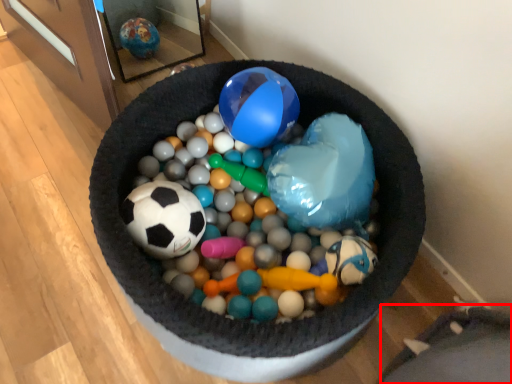
Question: Where is bean bag chair (annotated by the red box) located in relation to ball in the image?

Choices:
 (A) left
 (B) right

Answer: (B)